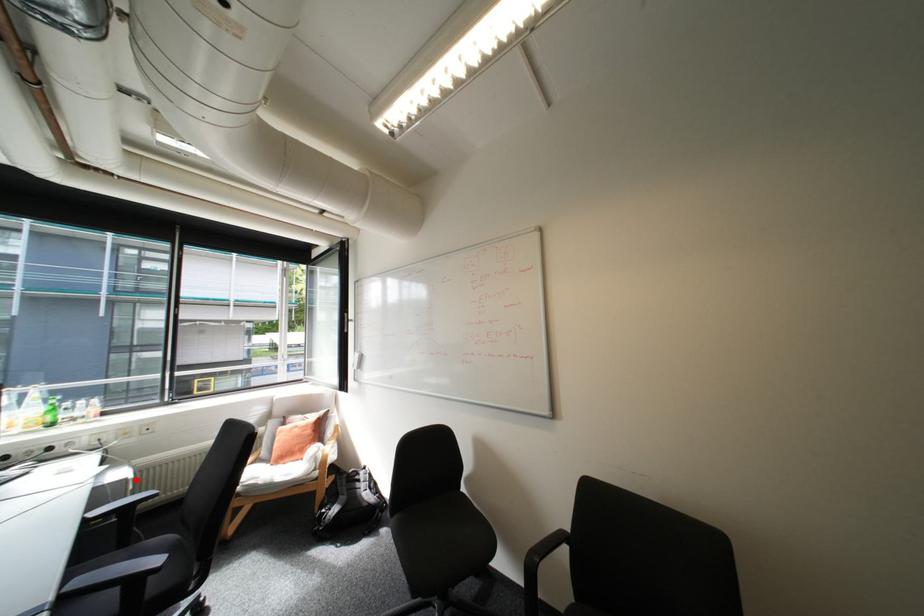
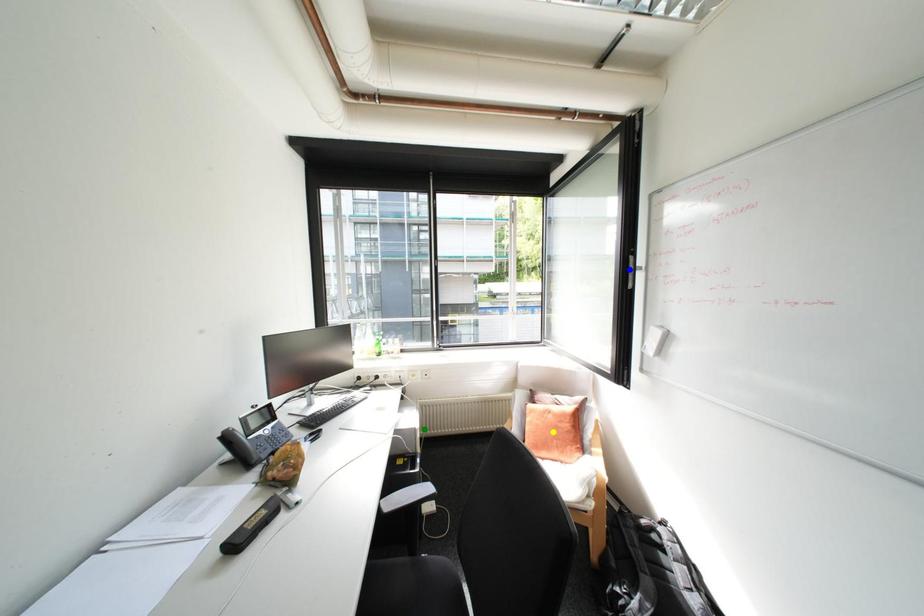
Question: I am providing you with two images of the same scene from different viewpoints. A red point is marked on the first image. You are given multiple points on the second image. Which point in image 2 is actually the same real-world point as the red point in image 1?

Choices:
 (A) blue point
 (B) yellow point
 (C) green point

Answer: (C)